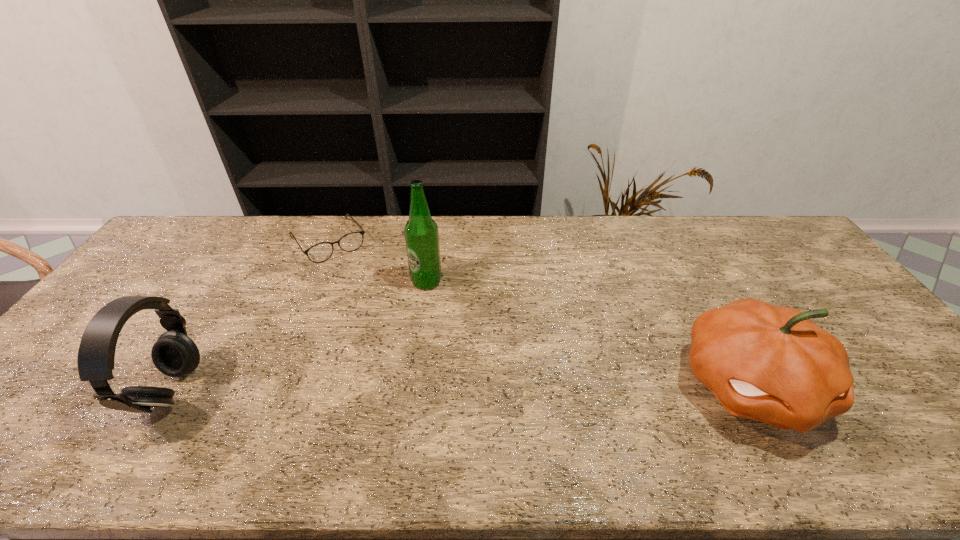
Where is `empty space between the pumpkin and the farthest object`? empty space between the pumpkin and the farthest object is located at coordinates (540, 313).

The width and height of the screenshot is (960, 540). In order to click on object that stands as the closest to the third nearest object in this screenshot , I will do `click(320, 252)`.

Select which object appears as the closest to the rightmost object. Please provide its 2D coordinates. Your answer should be formatted as a tuple, i.e. [(x, y)], where the tuple contains the x and y coordinates of a point satisfying the conditions above.

[(421, 233)]